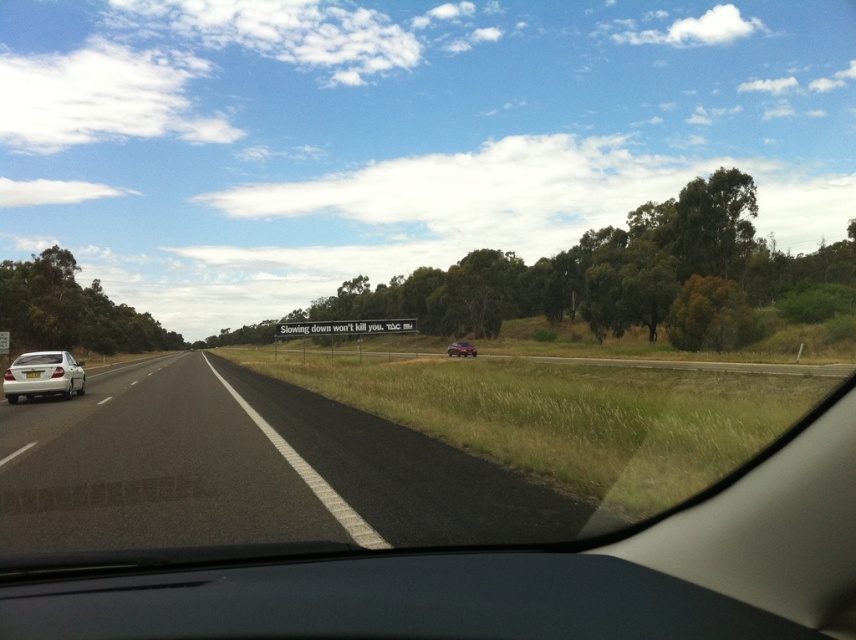
Is black asphalt road at center positioned in front of dark gray plastic dashboard at lower center?

No, black asphalt road at center is further to the viewer.

Between point (46, 484) and point (135, 580), which one is positioned in front?

Positioned in front is point (135, 580).

In order to click on black asphalt road at center in this screenshot , I will do pyautogui.click(x=245, y=468).

Is point (525, 557) closer to viewer compared to point (36, 355)?

Yes, point (525, 557) is closer to viewer.

Is point (0, 620) positioned after point (10, 372)?

That is False.

The width and height of the screenshot is (856, 640). What are the coordinates of `dark gray plastic dashboard at lower center` in the screenshot? It's located at (391, 602).

Is black asphalt road at center positioned in front of metallic silver car at center?

That is True.

Who is more forward, [201,385] or [455,353]?

Positioned in front is point [201,385].

Describe the element at coordinates (245, 468) in the screenshot. The image size is (856, 640). I see `black asphalt road at center` at that location.

Where is `black asphalt road at center`? black asphalt road at center is located at coordinates (245, 468).